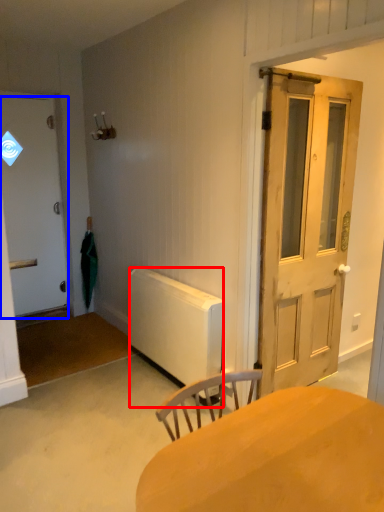
Question: Which point is further to the camera, radiator (highlighted by a red box) or door (highlighted by a blue box)?

Choices:
 (A) radiator
 (B) door

Answer: (B)